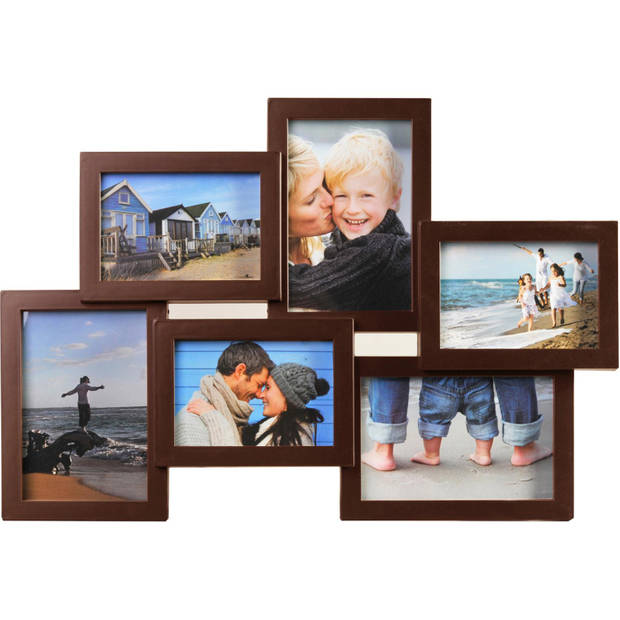
Locate an element on the screen. The width and height of the screenshot is (620, 620). dark wooden photo frame is located at coordinates (167, 159), (40, 301), (248, 333), (348, 110), (513, 232), (392, 366).